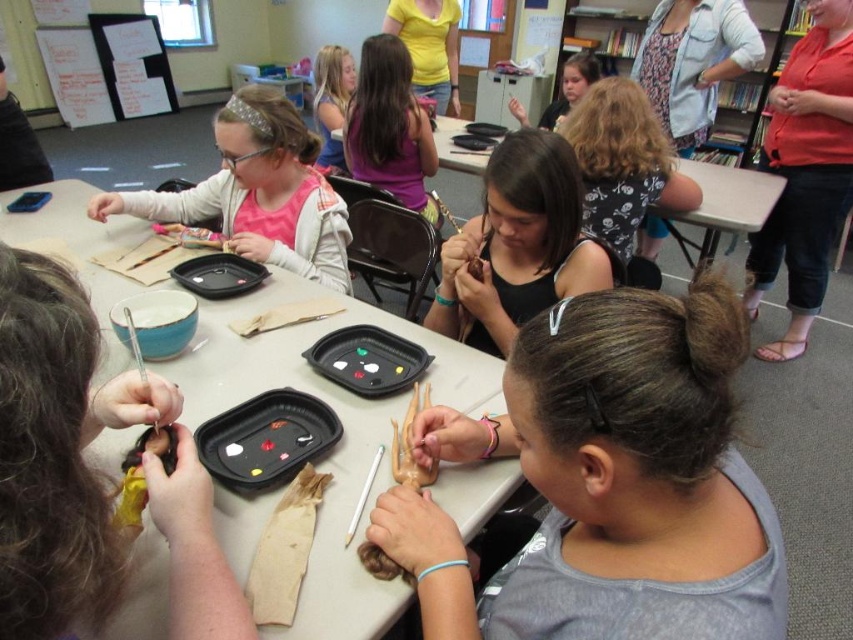
Question: Among these points, which one is nearest to the camera?

Choices:
 (A) (566, 220)
 (B) (325, 125)
 (C) (611, 352)
 (D) (474, 268)

Answer: (C)

Question: Is matte pink shirt at left to the right of brown matte clay doll at center from the viewer's perspective?

Choices:
 (A) yes
 (B) no

Answer: (B)

Question: Which object is the farthest from the matte black doll at center?

Choices:
 (A) matte pink shirt at left
 (B) brown matte clay hand at center
 (C) brown matte clay doll at center

Answer: (A)

Question: Can you confirm if matte brown doll at center is positioned below purple matte shirt at center?

Choices:
 (A) yes
 (B) no

Answer: (A)

Question: Among these objects, which one is nearest to the camera?

Choices:
 (A) yellow fabric doll at lower left
 (B) matte brown doll at center

Answer: (B)

Question: Can you confirm if matte red blouse at upper right is wider than yellow fabric doll at lower left?

Choices:
 (A) no
 (B) yes

Answer: (B)